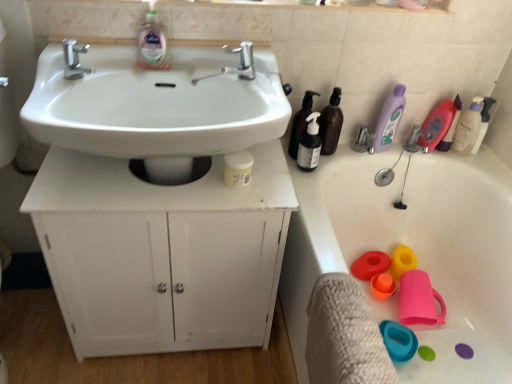
Locate an element on the screen. empty space that is ontop of pink rubber cup at lower right, arranged as the 1th toy when viewed from the front is located at coordinates (417, 288).